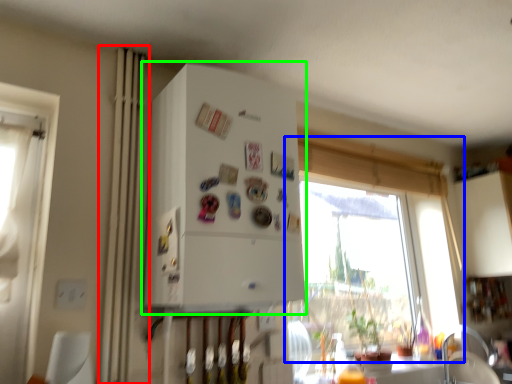
Question: Which object is positioned farthest from curtain (highlighted by a red box)? Select from window (highlighted by a blue box) and appliance (highlighted by a green box).

Choices:
 (A) window
 (B) appliance

Answer: (A)